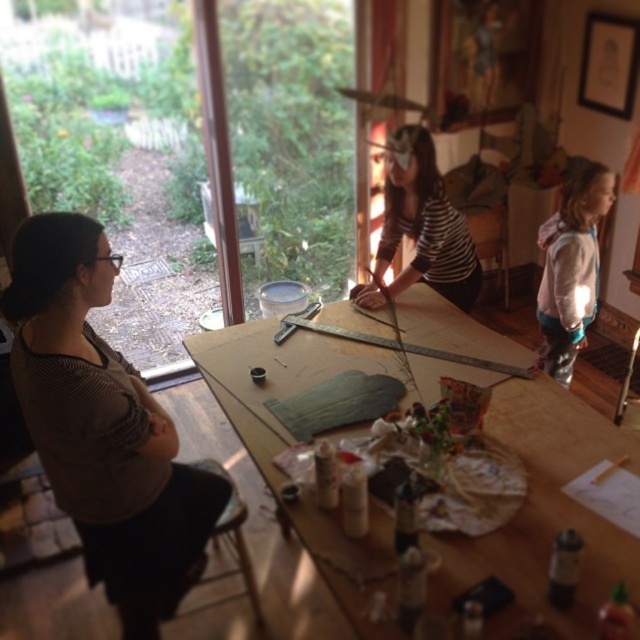
Where is the white fleece jacket at right located in the scene?

The white fleece jacket at right is located at point (572, 266) in the scene.

You are a visitor in the room and want to know if the brown striped shirt at left is taller than the wooden stool at lower left. Can you confirm this?

The brown striped shirt at left is taller than the wooden stool at lower left, so yes, the brown striped shirt at left is indeed taller than the wooden stool at lower left.

You are a person who is 1.7 meters tall and want to sit on the wooden stool at lower left. However, there is a white fleece jacket at right nearby. Considering their heights, can you sit on the stool without the jacket blocking your view?

The white fleece jacket at right is much taller than the wooden stool at lower left. Since the jacket is taller, it might block your view when sitting on the stool. Check the jacket position before sitting.